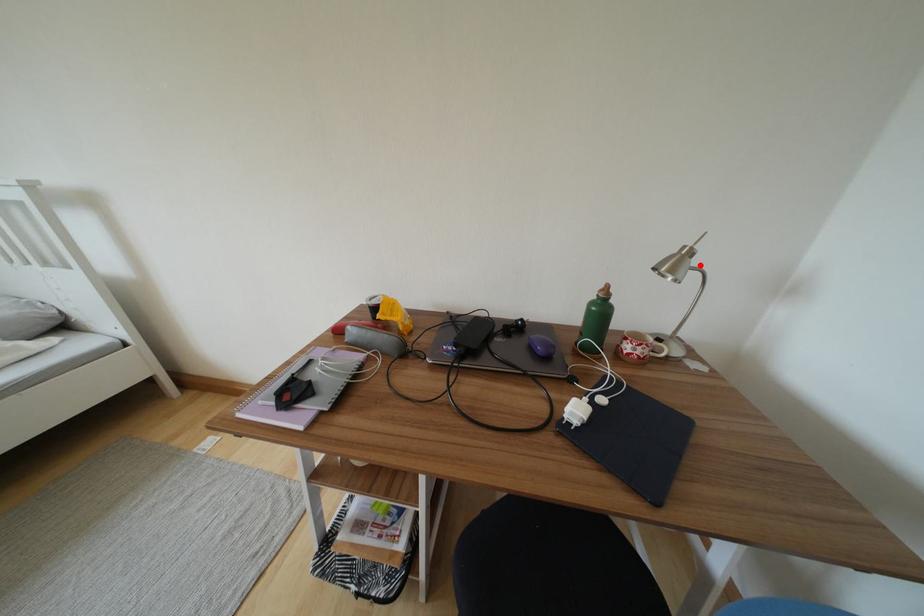
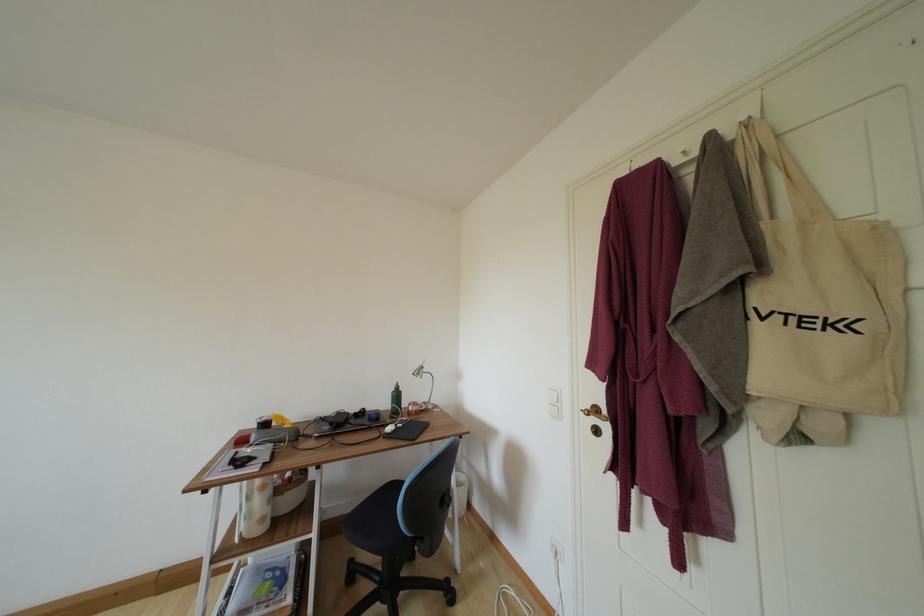
Find the pixel in the second image that matches the highlighted location in the first image.

(430, 374)